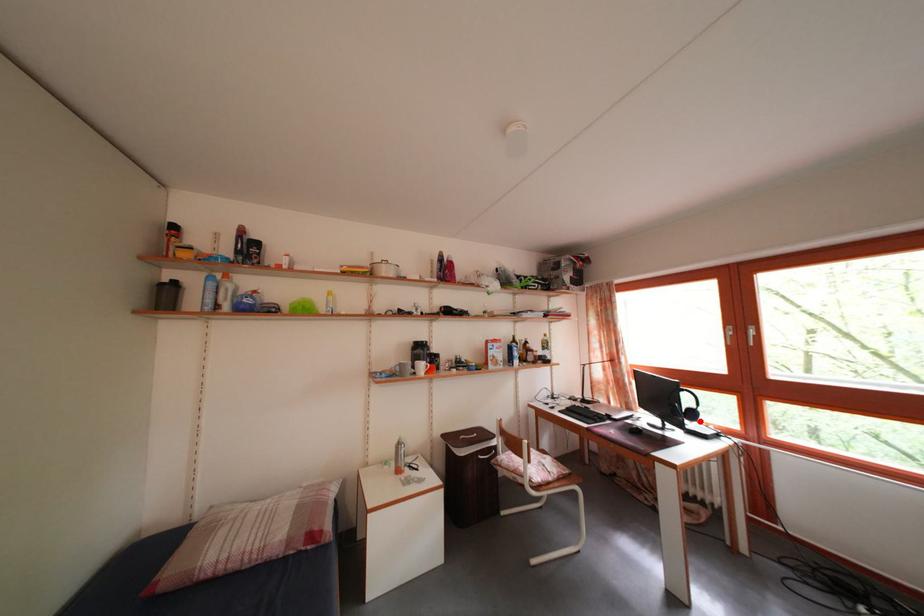
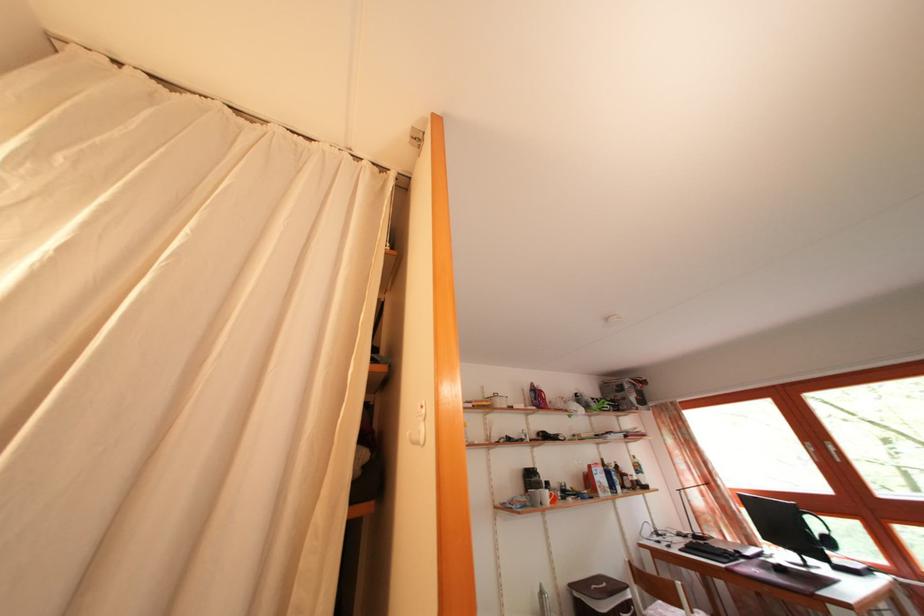
Locate, in the second image, the point that corresponds to the highlighted location in the first image.

(837, 549)